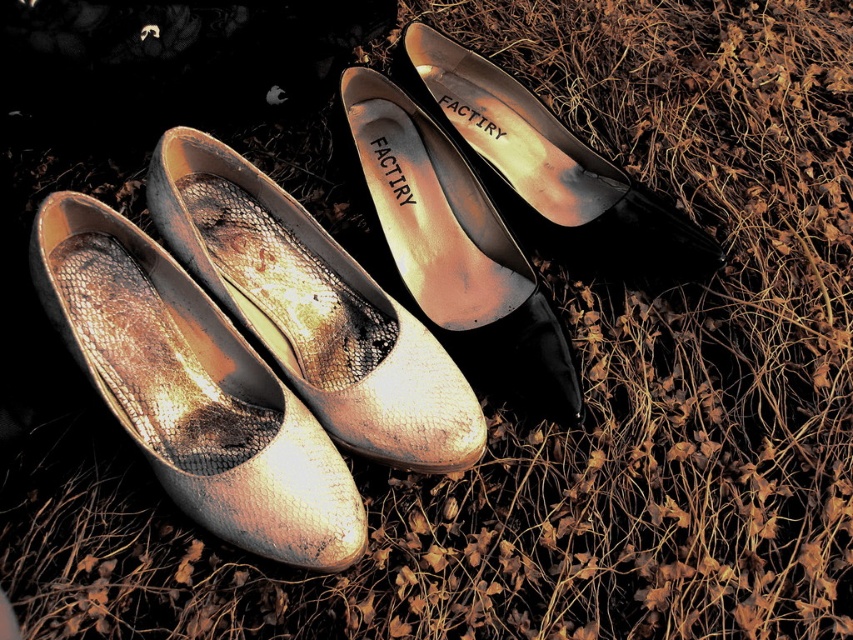
Question: Does metallic gold shoe at center appear on the right side of metallic snakeskin shoe at center?

Choices:
 (A) no
 (B) yes

Answer: (A)

Question: Based on their relative distances, which object is farther from the metallic gold shoe at upper center?

Choices:
 (A) metallic leather shoe at center
 (B) metallic snakeskin shoe at center

Answer: (B)

Question: Which object is the closest to the metallic gold shoe at center?

Choices:
 (A) metallic snakeskin shoe at center
 (B) metallic leather shoe at center
 (C) metallic gold shoe at upper center

Answer: (A)

Question: Where is metallic gold shoe at center located in relation to metallic leather shoe at center in the image?

Choices:
 (A) left
 (B) right

Answer: (A)

Question: Observing the image, what is the correct spatial positioning of metallic gold shoe at center in reference to metallic leather shoe at center?

Choices:
 (A) above
 (B) below

Answer: (B)

Question: Which point is farther to the camera?

Choices:
 (A) (413, 282)
 (B) (148, 417)
 (C) (463, 381)

Answer: (A)